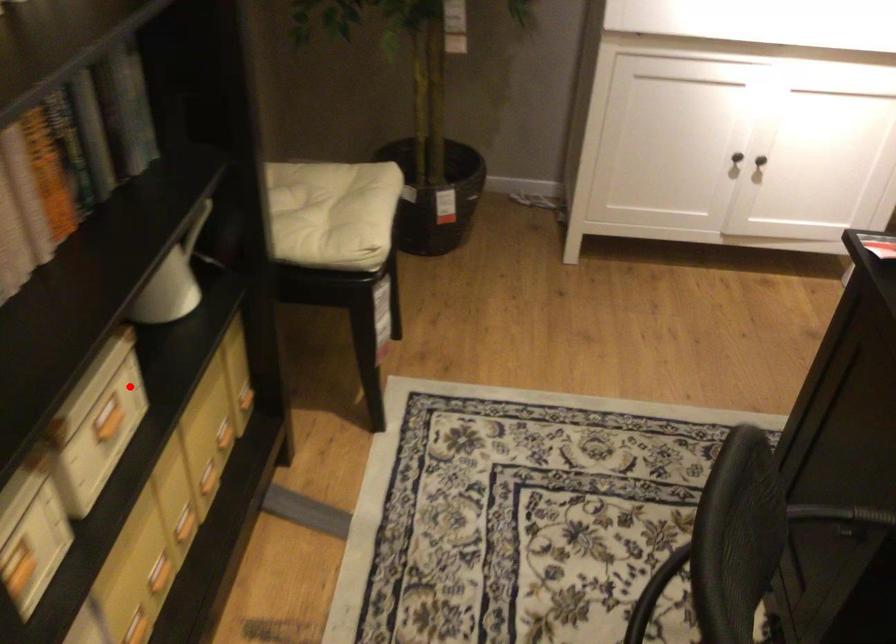
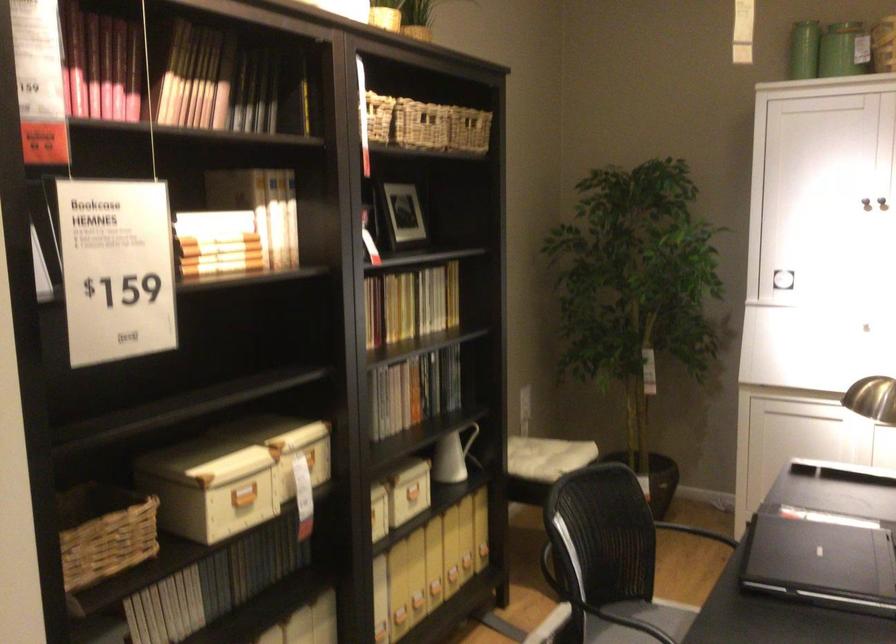
Question: I am providing you with two images of the same scene from different viewpoints. Given a red point in image1, look at the same physical point in image2. Is it:

Choices:
 (A) Closer to the viewpoint
 (B) Farther from the viewpoint

Answer: (B)